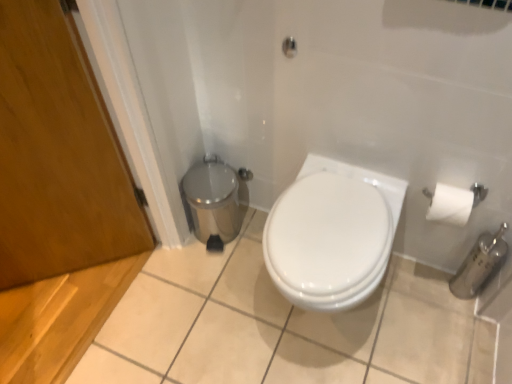
Question: Considering the relative positions of white glossy toilet at center and matte silver shower at upper center in the image provided, is white glossy toilet at center to the left or to the right of matte silver shower at upper center?

Choices:
 (A) right
 (B) left

Answer: (A)

Question: In terms of width, does white glossy toilet at center look wider or thinner when compared to matte silver shower at upper center?

Choices:
 (A) thin
 (B) wide

Answer: (B)

Question: Which of these objects is positioned closest to the white glossy toilet at center?

Choices:
 (A) wooden door at left
 (B) polished stainless steel trash can at lower left
 (C) matte silver shower at upper center

Answer: (B)

Question: Which is nearer to the wooden door at left?

Choices:
 (A) matte silver shower at upper center
 (B) polished stainless steel trash can at lower left
 (C) white glossy toilet at center

Answer: (B)